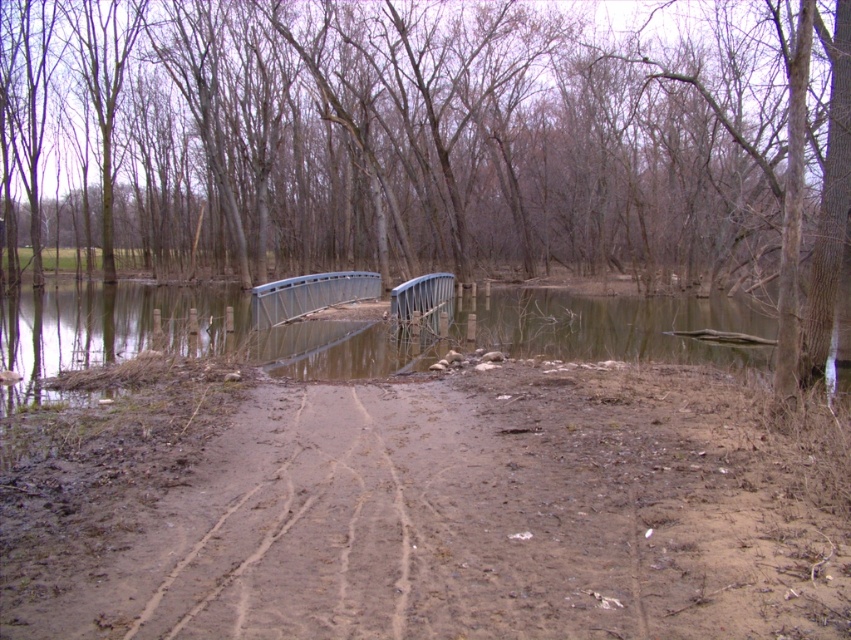
Question: Estimate the real-world distances between objects in this image. Which object is closer to the metallic gray bridge at center?

Choices:
 (A) brown muddy dirt track at center
 (B) brown wood tree at center

Answer: (A)

Question: Does brown muddy dirt track at center appear under metallic gray bridge at center?

Choices:
 (A) no
 (B) yes

Answer: (B)

Question: Can you confirm if brown muddy dirt track at center is smaller than metallic gray bridge at center?

Choices:
 (A) yes
 (B) no

Answer: (A)

Question: Estimate the real-world distances between objects in this image. Which object is closer to the metallic gray bridge at center?

Choices:
 (A) brown muddy dirt track at center
 (B) brown wood tree at center

Answer: (A)

Question: Which of the following is the farthest from the observer?

Choices:
 (A) (435, 284)
 (B) (841, 138)
 (C) (104, 417)

Answer: (A)

Question: Observing the image, what is the correct spatial positioning of brown wood tree at center in reference to metallic gray bridge at center?

Choices:
 (A) left
 (B) right

Answer: (A)